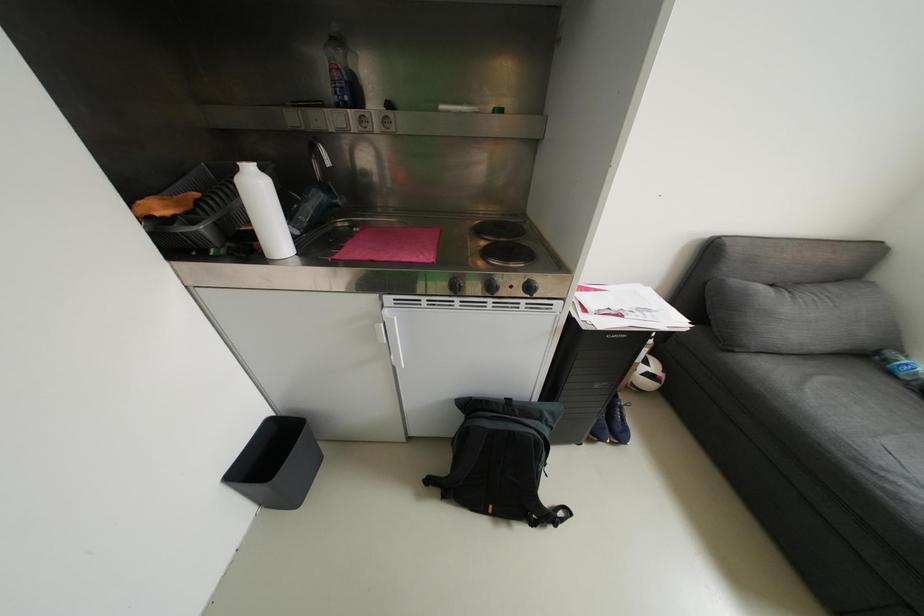
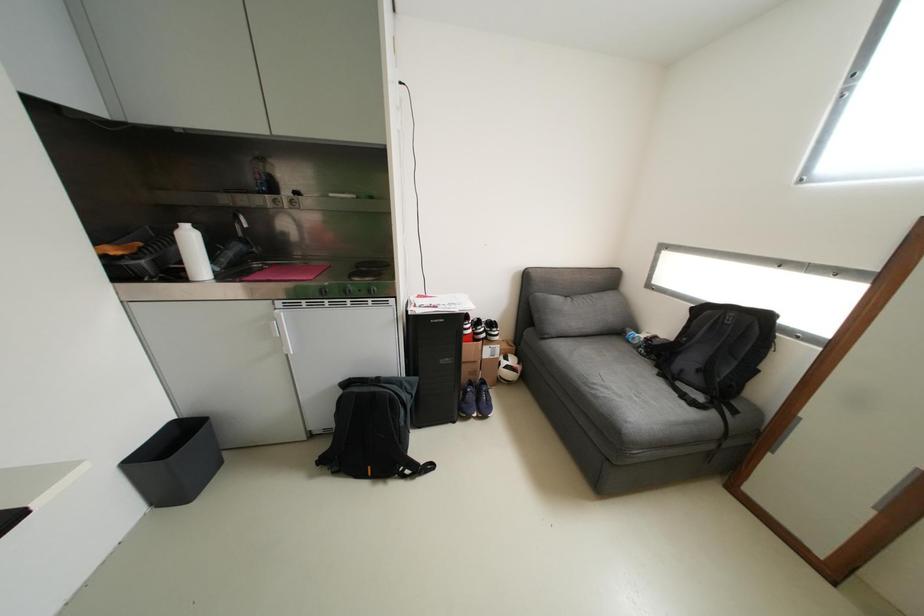
Question: How did the camera likely rotate?

Choices:
 (A) Left
 (B) Right
 (C) Up
 (D) Down

Answer: (C)